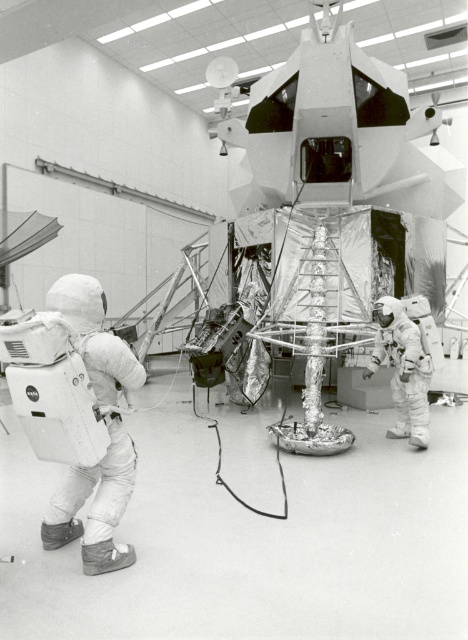
Between white fabric spacesuit at left and white textured spacesuit at center-right, which one is positioned lower?

white fabric spacesuit at left

Is white fabric spacesuit at left closer to the viewer compared to white textured spacesuit at center-right?

Yes, it is.

Locate an element on the screen. white fabric spacesuit at left is located at coordinates (95, 504).